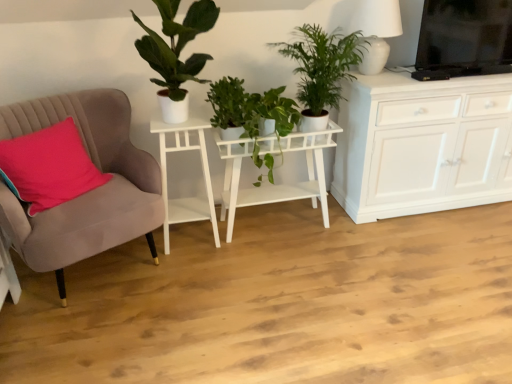
The height and width of the screenshot is (384, 512). I want to click on vacant space in white matte plant stand at center, the first table positioned from the right (from a real-world perspective), so click(x=278, y=224).